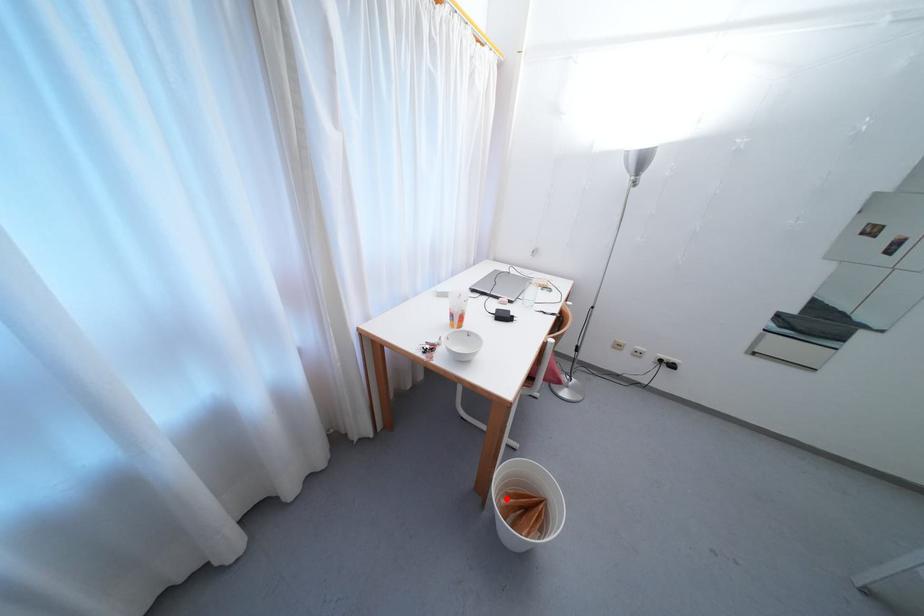
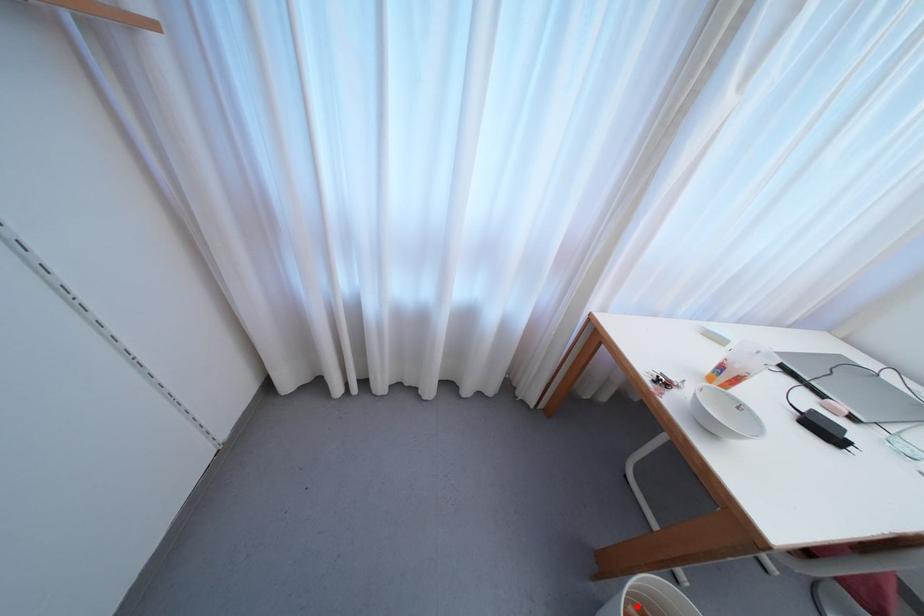
I am providing you with two images of the same scene from different viewpoints. A red point is marked on the first image and another point is marked on the second image. Are the points marked in image1 and image2 representing the same 3D position?

Yes